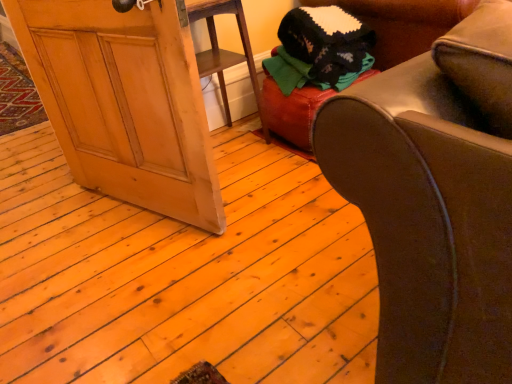
Question: Is knitted wool sweater at upper right taller or shorter than wooden screen door at lower left?

Choices:
 (A) short
 (B) tall

Answer: (A)

Question: From a real-world perspective, relative to wooden screen door at lower left, is knitted wool sweater at upper right vertically above or below?

Choices:
 (A) below
 (B) above

Answer: (A)

Question: Estimate the real-world distances between objects in this image. Which object is farther from the leather ottoman at center?

Choices:
 (A) knitted wool sweater at upper right
 (B) wooden screen door at lower left

Answer: (B)

Question: Which of these objects is positioned farthest from the knitted wool sweater at upper right?

Choices:
 (A) wooden screen door at lower left
 (B) leather ottoman at center

Answer: (A)